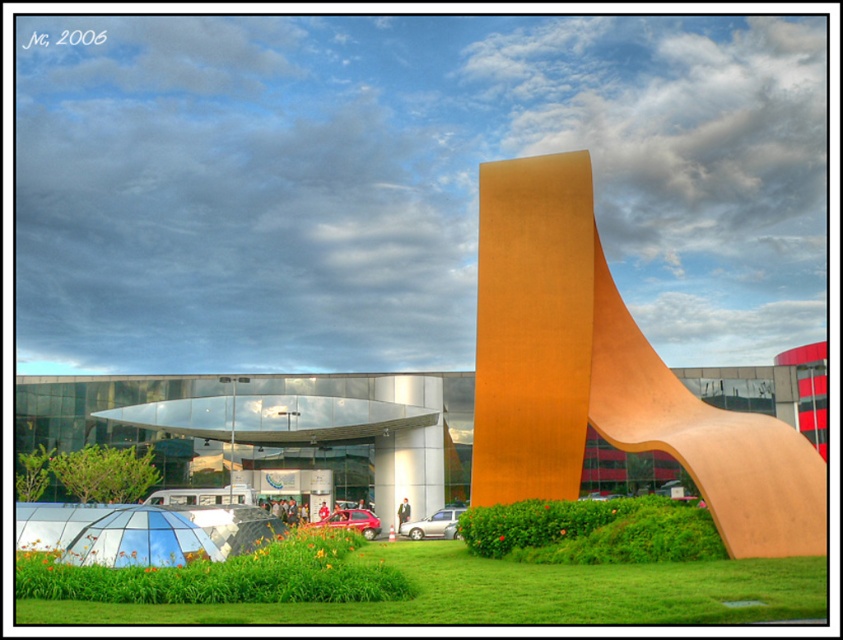
Question: Is matte orange sculpture at center positioned before green leafy bush at center?

Choices:
 (A) no
 (B) yes

Answer: (B)

Question: Observing the image, what is the correct spatial positioning of matte orange sculpture at center in reference to green grass at lower center?

Choices:
 (A) below
 (B) above

Answer: (B)

Question: Does green grass at lower center appear on the right side of green leafy bush at center?

Choices:
 (A) yes
 (B) no

Answer: (B)

Question: Which of the following is the closest to the observer?

Choices:
 (A) (785, 481)
 (B) (513, 518)
 (C) (607, 579)

Answer: (C)

Question: Which object is positioned farthest from the green grass at lower center?

Choices:
 (A) matte orange sculpture at center
 (B) green leafy bush at center

Answer: (A)

Question: Which point is closer to the camera?

Choices:
 (A) green grass at lower center
 (B) matte orange sculpture at center
 (C) green leafy bush at center

Answer: (A)